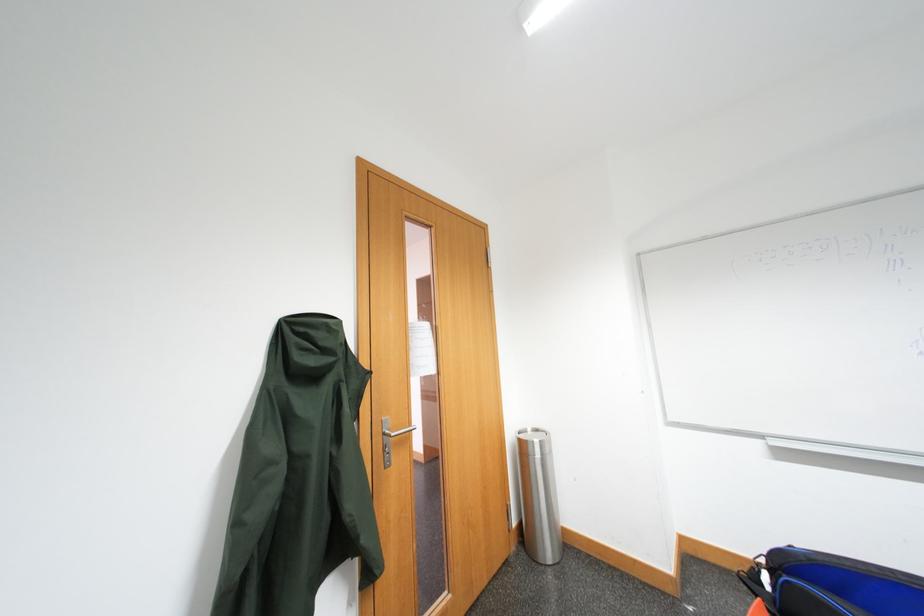
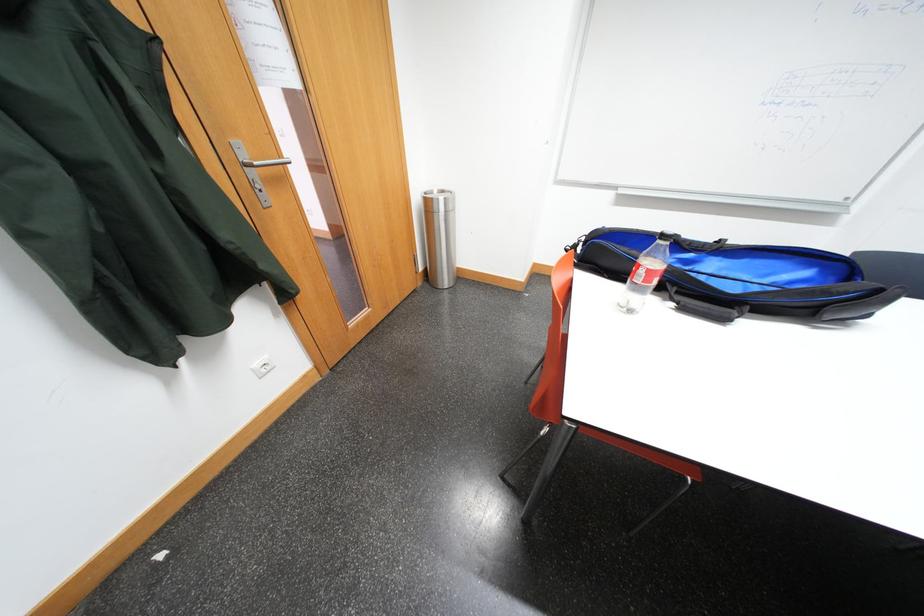
The first image is from the beginning of the video and the second image is from the end. How did the camera likely rotate when shooting the video?

The camera rotated toward right-down.